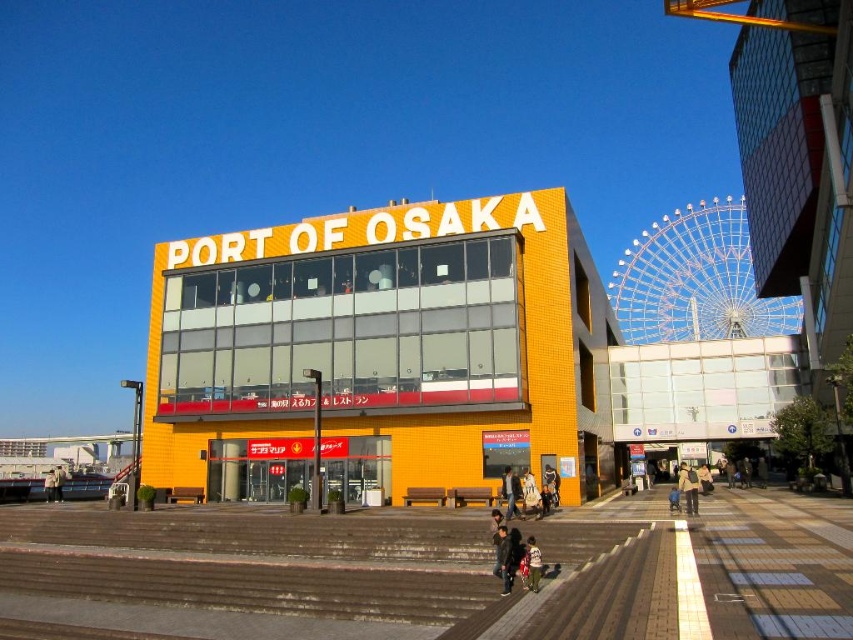
You are a store manager at the PORT OF OSAKA building and you need to arrange two jackets for display. The jackets are the light brown leather jacket at center and the light beige jacket at center. Which jacket should you place on the smaller display stand?

The light brown leather jacket at center is smaller than the light beige jacket at center, so it should be placed on the smaller display stand.

You are standing in the plaza in front of the PORT OF OSAKA building. You see two points marked on the ground. The first point is at coordinate point (688, 500) and the second is at point (49, 484). If you were to walk towards both points from your current position, which point would you reach first?

→ The point at (688, 500) is closer to you than the point at (49, 484), so you would reach it first.

From the picture: You are standing in the plaza in front of the yellow brick building at center and the light brown fabric pants at center. Which object is closer to you?

The light brown fabric pants at center are closer to you because the yellow brick building at center is positioned over it, meaning the pants are in front.